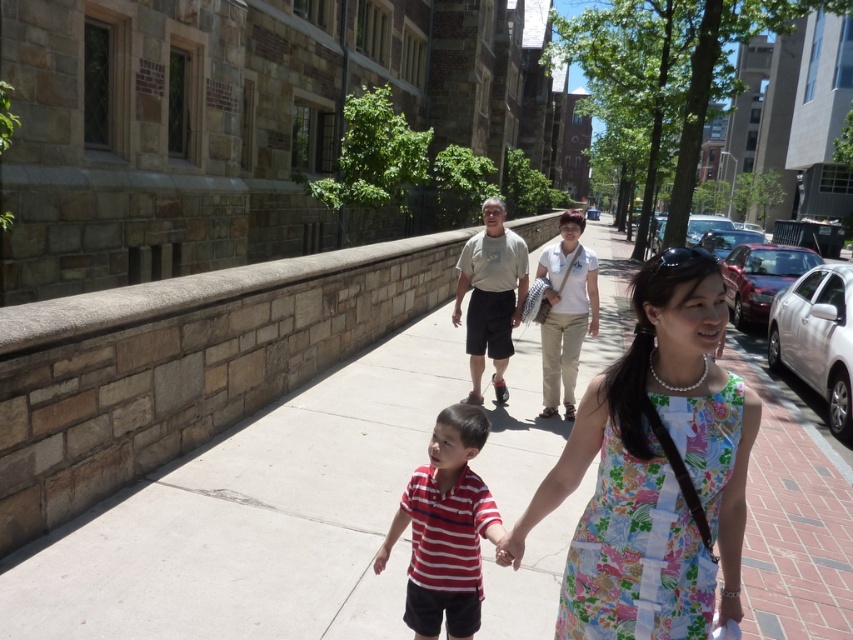
Question: Does concrete at center appear on the right side of light gray t-shirt at center?

Choices:
 (A) yes
 (B) no

Answer: (A)

Question: Which object is closer to the camera taking this photo?

Choices:
 (A) floral fabric dress at center
 (B) striped cotton shirt at center
 (C) concrete at center
 (D) light gray t-shirt at center

Answer: (A)

Question: Is concrete at center wider than floral fabric dress at center?

Choices:
 (A) no
 (B) yes

Answer: (B)

Question: Which point appears farthest from the camera in this image?

Choices:
 (A) (480, 326)
 (B) (117, 496)
 (C) (634, 628)
 (D) (453, 589)

Answer: (A)

Question: Is striped cotton shirt at center below light gray t-shirt at center?

Choices:
 (A) yes
 (B) no

Answer: (A)

Question: Which point is closer to the camera?

Choices:
 (A) floral fabric dress at center
 (B) striped cotton shirt at center
 (C) concrete at center
 (D) light gray t-shirt at center

Answer: (A)